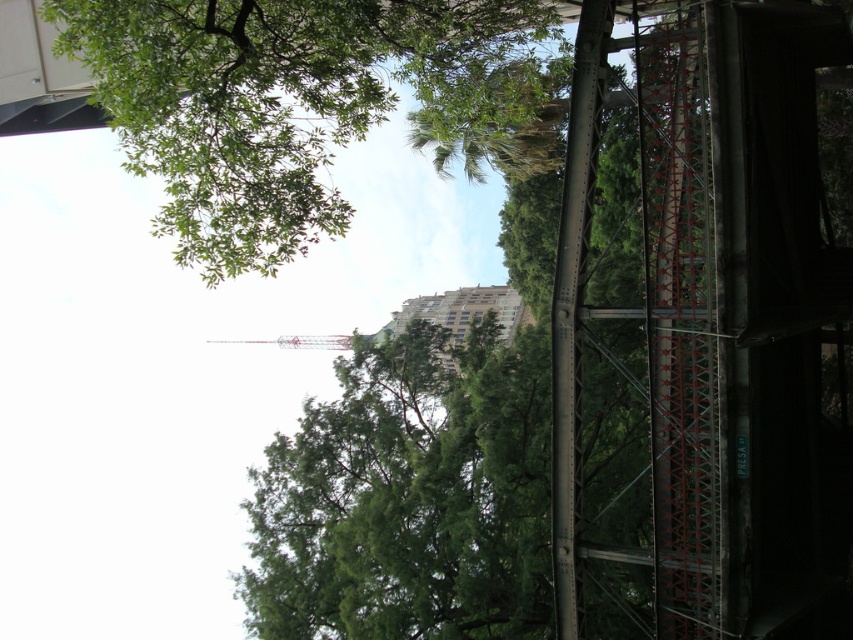
Which of these two, green leafy tree at upper left or metallic pink tower at center, stands shorter?

With less height is metallic pink tower at center.

Image resolution: width=853 pixels, height=640 pixels. What are the coordinates of `green leafy tree at upper left` in the screenshot? It's located at (285, 100).